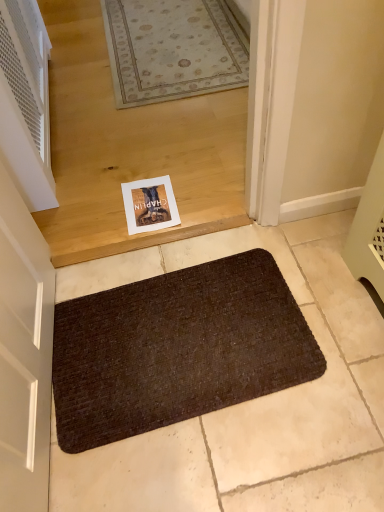
Question: Is white perforated vent at left to the left or to the right of brown textured bath mat at lower center in the image?

Choices:
 (A) left
 (B) right

Answer: (A)

Question: In the image, is white perforated vent at left positioned in front of or behind brown textured bath mat at lower center?

Choices:
 (A) front
 (B) behind

Answer: (B)

Question: From their relative heights in the image, would you say white perforated vent at left is taller or shorter than brown textured bath mat at lower center?

Choices:
 (A) short
 (B) tall

Answer: (B)

Question: Is brown textured bath mat at lower center bigger or smaller than white perforated vent at left?

Choices:
 (A) small
 (B) big

Answer: (A)

Question: From a real-world perspective, is brown textured bath mat at lower center positioned above or below white perforated vent at left?

Choices:
 (A) below
 (B) above

Answer: (A)

Question: Would you say brown textured bath mat at lower center is to the left or to the right of white perforated vent at left in the picture?

Choices:
 (A) left
 (B) right

Answer: (B)

Question: Is brown textured bath mat at lower center taller or shorter than white perforated vent at left?

Choices:
 (A) short
 (B) tall

Answer: (A)